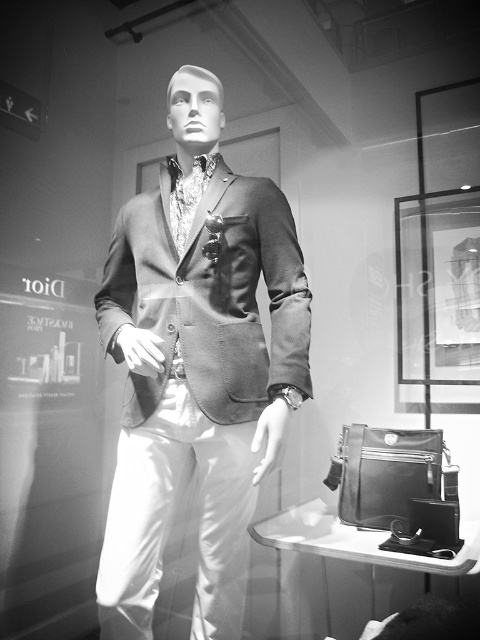
Question: Can you confirm if suede-like brown jacket at center is bigger than glass frame at upper right?

Choices:
 (A) no
 (B) yes

Answer: (B)

Question: Estimate the real-world distances between objects in this image. Which object is farther from the satin-like brown blazer at center?

Choices:
 (A) suede-like brown jacket at center
 (B) glass frame at upper right

Answer: (B)

Question: Does suede-like brown jacket at center appear over glass frame at upper right?

Choices:
 (A) no
 (B) yes

Answer: (A)

Question: Which point is farther from the camera taking this photo?

Choices:
 (A) (269, 376)
 (B) (179, 422)

Answer: (B)

Question: Among these points, which one is nearest to the camera?

Choices:
 (A) (190, 76)
 (B) (460, 115)
 (C) (222, 282)

Answer: (C)

Question: Can you confirm if satin-like brown blazer at center is smaller than suede-like brown jacket at center?

Choices:
 (A) no
 (B) yes

Answer: (A)